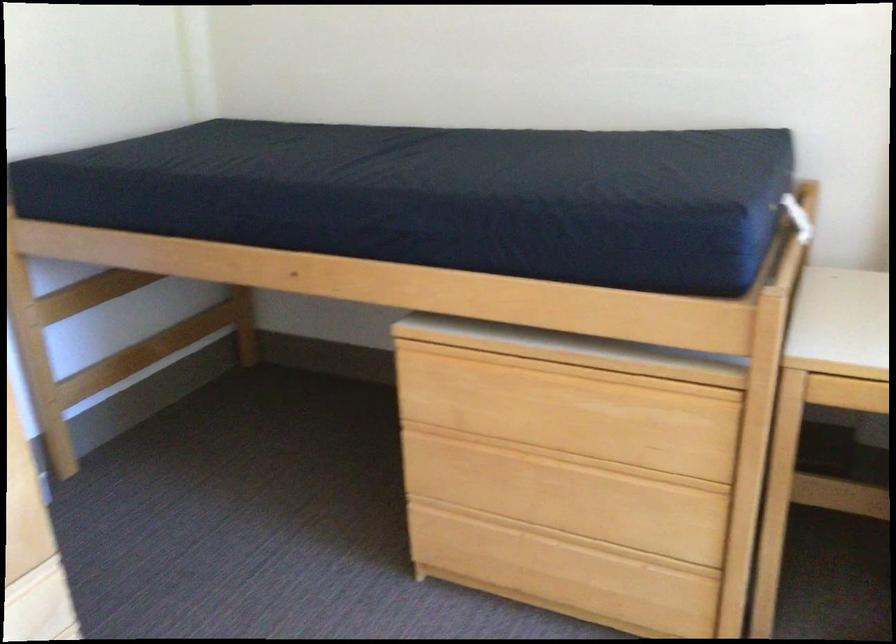
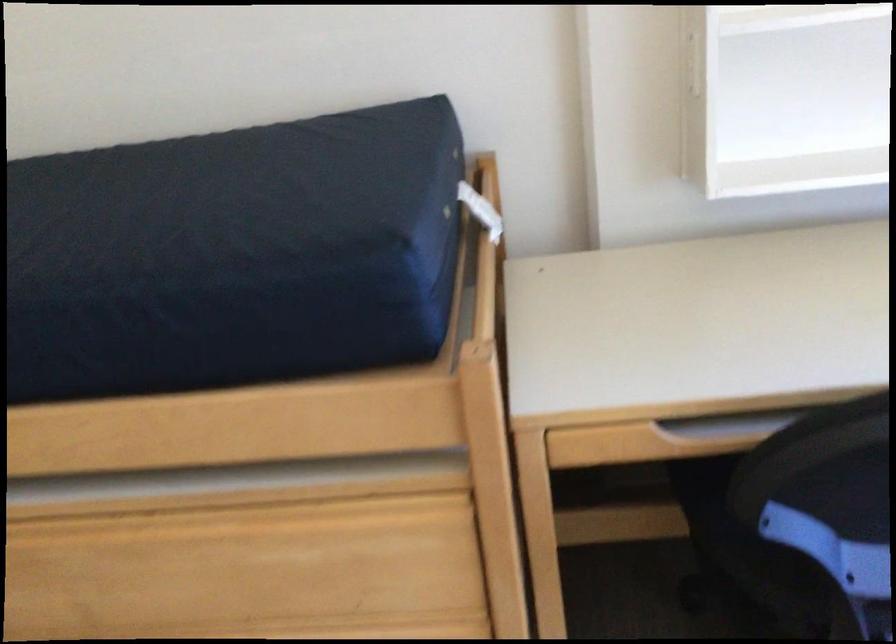
Question: How did the camera likely rotate?

Choices:
 (A) Left
 (B) Right
 (C) Up
 (D) Down

Answer: (B)